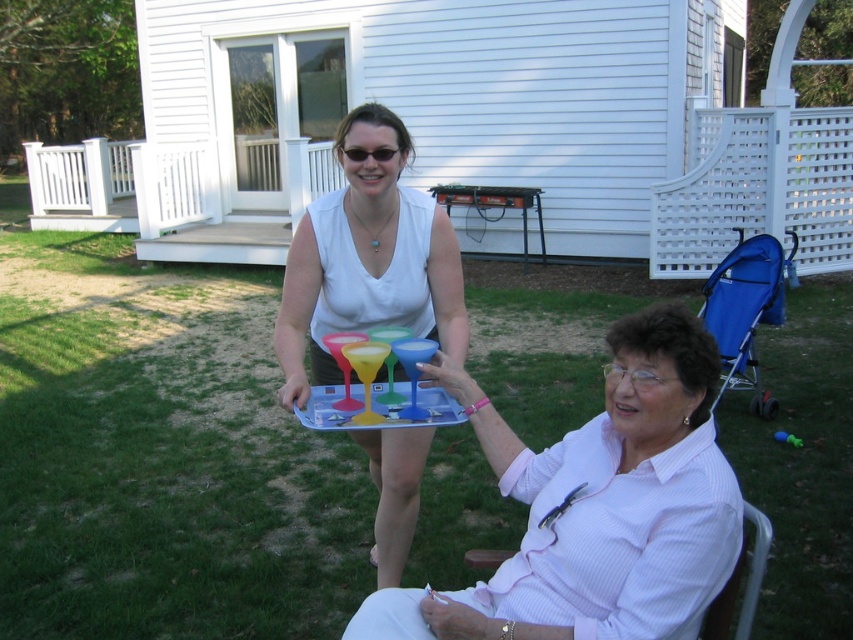
Between matte plastic glasses at lower right and translucent plastic tray at center, which one is positioned higher?

Positioned higher is translucent plastic tray at center.

Who is lower down, matte plastic glasses at lower right or translucent plastic tray at center?

Positioned lower is matte plastic glasses at lower right.

Does point (625, 428) come farther from viewer compared to point (415, 404)?

No, it is in front of (415, 404).

Locate an element on the screen. Image resolution: width=853 pixels, height=640 pixels. matte plastic glasses at lower right is located at coordinates (598, 506).

Does transparent plastic tray at center come in front of translucent plastic tray at center?

No, it is behind translucent plastic tray at center.

Who is taller, transparent plastic tray at center or translucent plastic tray at center?

transparent plastic tray at center is taller.

Between point (573, 426) and point (312, 419), which one is positioned in front?

Point (312, 419)

This screenshot has width=853, height=640. What are the coordinates of `transparent plastic tray at center` in the screenshot? It's located at (161, 456).

Who is shorter, transparent plastic tray at center or blue fabric folding chair at lower right?

With less height is blue fabric folding chair at lower right.

Does point (224, 508) come farther from viewer compared to point (724, 276)?

No, (224, 508) is in front of (724, 276).

Identify the location of transparent plastic tray at center. (161, 456).

Where is `transparent plastic tray at center`? The width and height of the screenshot is (853, 640). transparent plastic tray at center is located at coordinates (161, 456).